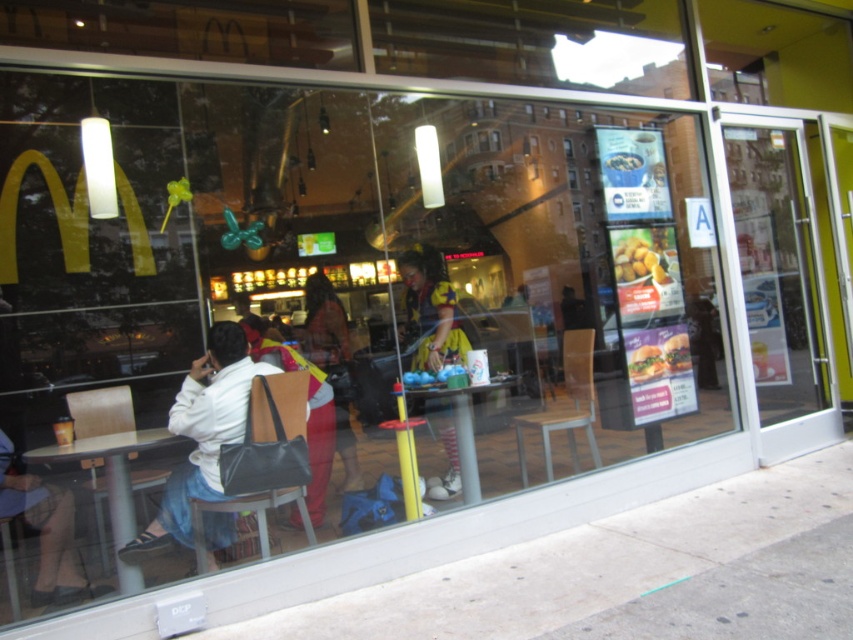
Between gray concrete pavement at lower left and white matte jacket at left, which one appears on the left side from the viewer's perspective?

From the viewer's perspective, white matte jacket at left appears more on the left side.

Find the location of a particular element. The height and width of the screenshot is (640, 853). gray concrete pavement at lower left is located at coordinates (578, 563).

Can you confirm if gray concrete pavement at lower left is positioned above yellow polka dot dress at center?

Actually, gray concrete pavement at lower left is below yellow polka dot dress at center.

Can you confirm if gray concrete pavement at lower left is bigger than yellow polka dot dress at center?

Correct, gray concrete pavement at lower left is larger in size than yellow polka dot dress at center.

Does point (735, 528) come farther from viewer compared to point (437, 342)?

No, it is not.

Identify the location of gray concrete pavement at lower left. (x=578, y=563).

Is white matte jacket at left behind matte yellow dress at center?

No, it is not.

Which is above, white matte jacket at left or matte yellow dress at center?

matte yellow dress at center is higher up.

Describe the element at coordinates (202, 435) in the screenshot. This screenshot has width=853, height=640. I see `white matte jacket at left` at that location.

I want to click on white matte jacket at left, so click(x=202, y=435).